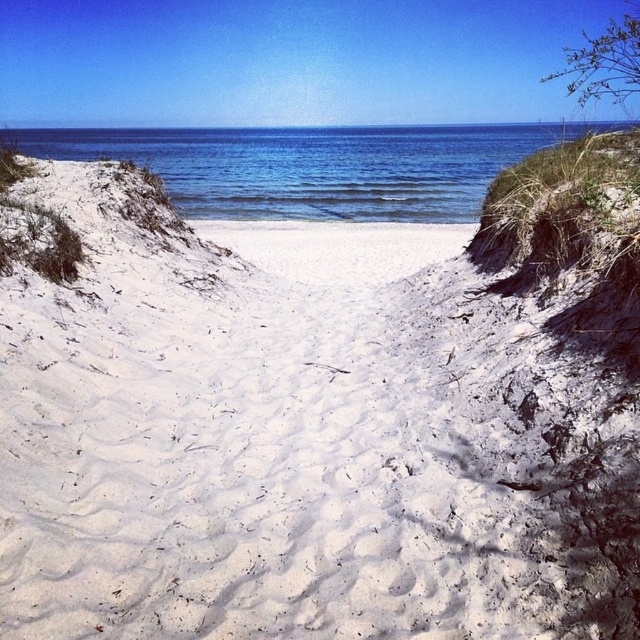
Question: Can you confirm if blue water at center is wider than white sandy beach at center?

Choices:
 (A) yes
 (B) no

Answer: (A)

Question: Which point appears farthest from the camera in this image?

Choices:
 (A) (324, 156)
 (B) (296, 237)

Answer: (A)

Question: Can you confirm if blue water at center is positioned to the right of white sandy beach at center?

Choices:
 (A) no
 (B) yes

Answer: (A)

Question: Which object appears closest to the camera in this image?

Choices:
 (A) blue water at center
 (B) white sandy beach at center

Answer: (B)

Question: Is blue water at center bigger than white sandy beach at center?

Choices:
 (A) yes
 (B) no

Answer: (A)

Question: Which point is closer to the camera taking this photo?

Choices:
 (A) [x=340, y=273]
 (B) [x=408, y=188]

Answer: (A)